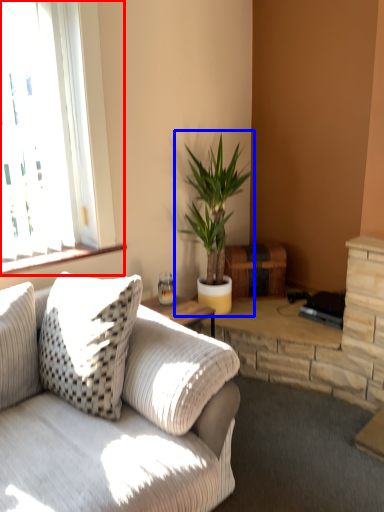
Question: Among these objects, which one is farthest to the camera, window (highlighted by a red box) or houseplant (highlighted by a blue box)?

Choices:
 (A) window
 (B) houseplant

Answer: (B)